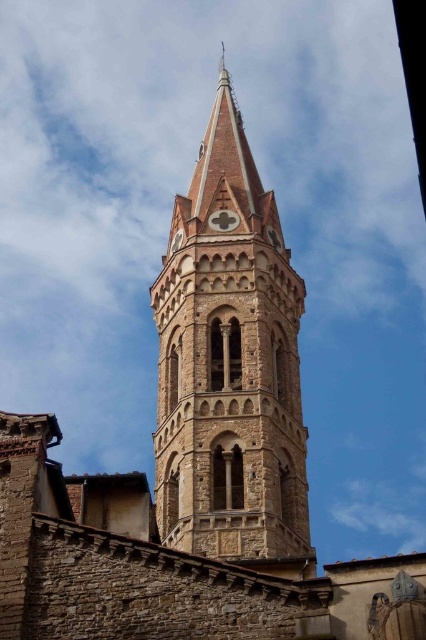
You are a maintenance worker needing to inspect both the brown stone tower at center and the matte stone clock at upper center. Given that your ladder can extend up to 8 meters, can you safely reach both objects without moving the ladder?

The brown stone tower at center and the matte stone clock at upper center are 8.56 meters apart from each other. Since the ladder can only extend up to 8 meters, it is not long enough to reach both objects safely without moving the ladder.

You are standing at the base of the bell tower and looking up. There are two points marked on the tower. Which point, point (227, 234) or point (233, 225), is closer to you?

Point (227, 234) is in front of point (233, 225), so it is closer to you.

You are an architect examining the bell tower and notice the brown stone tower at center and the matte stone clock at upper center. Which object is significantly larger in height?

The brown stone tower at center is much taller than the matte stone clock at upper center.